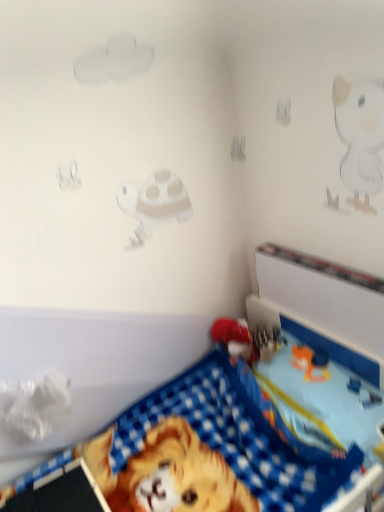
Question: In terms of width, does blue fabric blanket at lower right, which is the 2th toy in right-to-left order, look wider or thinner when compared to matte red toy at center, the first toy positioned from the right?

Choices:
 (A) wide
 (B) thin

Answer: (A)

Question: Do you think blue fabric blanket at lower right, which is counted as the first toy, starting from the left, is within matte red toy at center, the 2th toy in the left-to-right sequence, or outside of it?

Choices:
 (A) outside
 (B) inside

Answer: (A)

Question: Considering the positions of point (324, 406) and point (220, 325), is point (324, 406) closer or farther from the camera than point (220, 325)?

Choices:
 (A) closer
 (B) farther

Answer: (A)

Question: Considering their positions, is matte red toy at center, the first toy positioned from the right, located in front of or behind blue fabric blanket at lower right, which is the 2th toy in right-to-left order?

Choices:
 (A) behind
 (B) front

Answer: (A)

Question: Is matte red toy at center, the 2th toy in the left-to-right sequence, taller or shorter than blue fabric blanket at lower right, which is the 2th toy in right-to-left order?

Choices:
 (A) tall
 (B) short

Answer: (B)

Question: From the image's perspective, relative to blue fabric blanket at lower right, which is the 2th toy in right-to-left order, is matte red toy at center, the 2th toy in the left-to-right sequence, above or below?

Choices:
 (A) above
 (B) below

Answer: (A)

Question: Considering the relative positions of matte red toy at center, the first toy positioned from the right, and blue fabric blanket at lower right, which is the 2th toy in right-to-left order, in the image provided, is matte red toy at center, the first toy positioned from the right, to the left or to the right of blue fabric blanket at lower right, which is the 2th toy in right-to-left order,?

Choices:
 (A) right
 (B) left

Answer: (A)